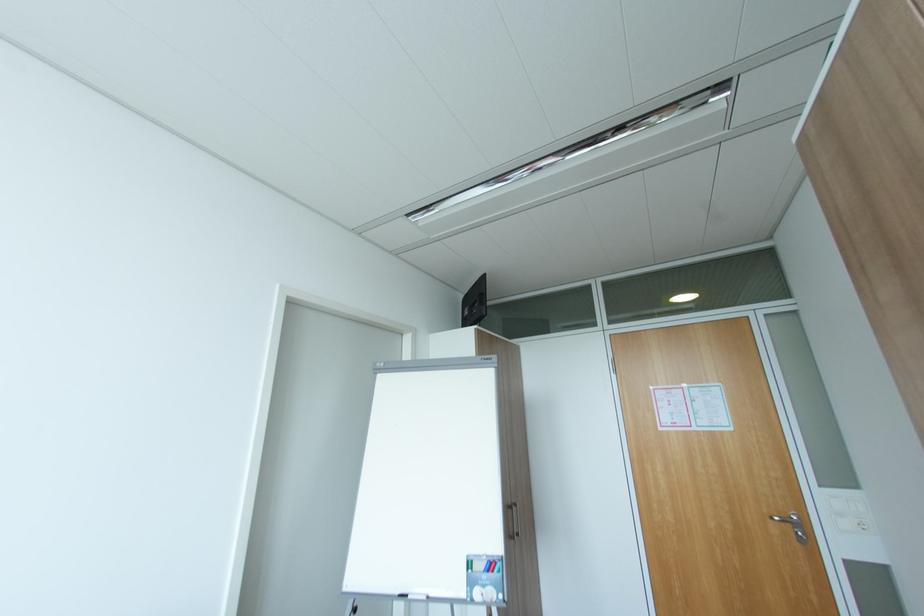
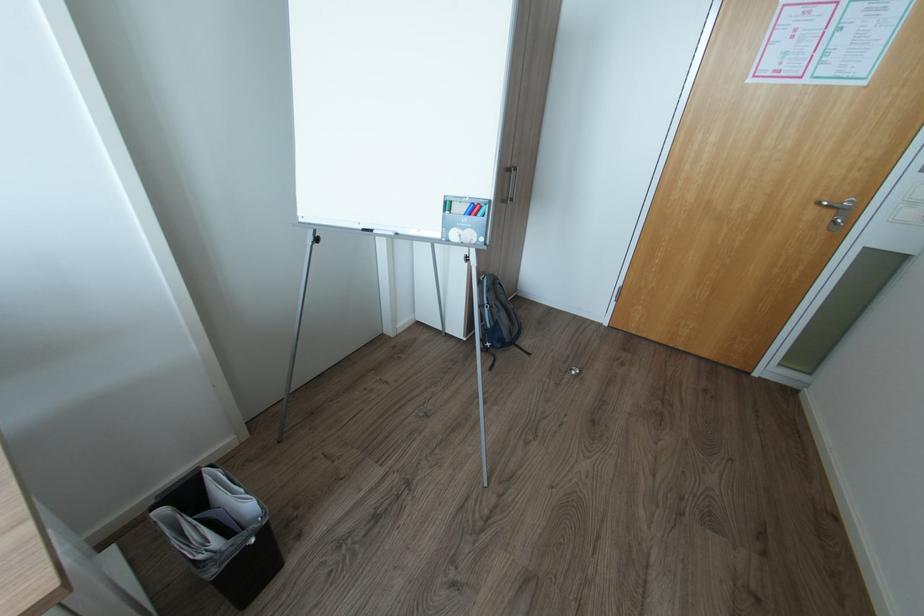
In the second image, find the point that corresponds to point (783, 517) in the first image.

(830, 204)